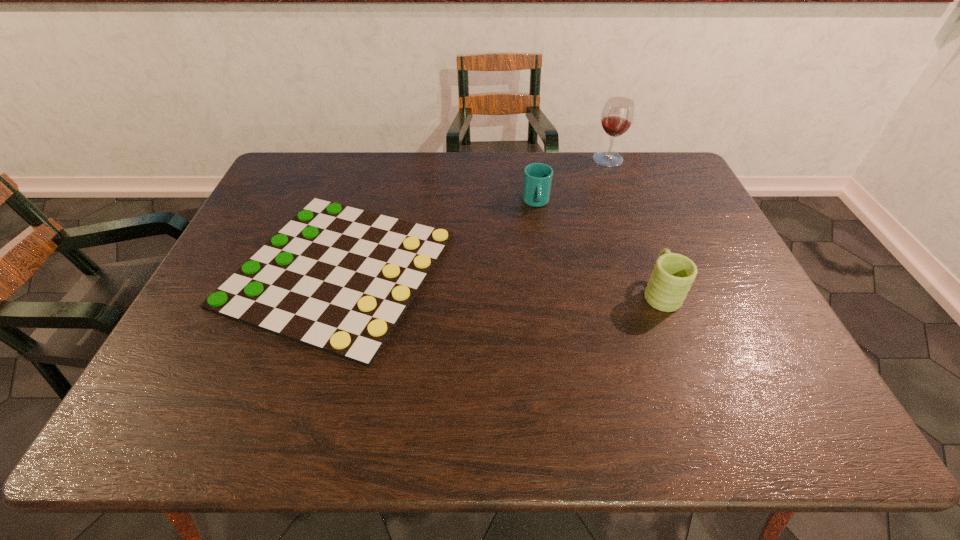
At what (x,y) coordinates should I click in order to perform the action: click on wineglass. Please return your answer as a coordinate pair (x, y). The width and height of the screenshot is (960, 540). Looking at the image, I should click on (617, 116).

You are a GUI agent. You are given a task and a screenshot of the screen. Output one action in this format:
    pyautogui.click(x=<x>, y=<y>)
    Task: Click on the farthest object
    The image size is (960, 540).
    Given the screenshot: What is the action you would take?
    [x=617, y=116]

This screenshot has width=960, height=540. What are the coordinates of `mug` in the screenshot? It's located at (671, 279).

Locate an element on the screen. This screenshot has height=540, width=960. the third object from right to left is located at coordinates (537, 182).

The width and height of the screenshot is (960, 540). In order to click on the shortest object in this screenshot , I will do `click(338, 279)`.

This screenshot has height=540, width=960. I want to click on checkerboard, so click(x=338, y=279).

Where is `free space located on the front of the farthest object`? Image resolution: width=960 pixels, height=540 pixels. free space located on the front of the farthest object is located at coordinates (614, 176).

Where is `vacant space situated 0.320m on the side of the mug with the handle`? vacant space situated 0.320m on the side of the mug with the handle is located at coordinates (625, 200).

Image resolution: width=960 pixels, height=540 pixels. What are the coordinates of `free spot located 0.340m on the side of the mug with the handle` in the screenshot? It's located at (624, 196).

Where is `free location located on the side of the mug with the handle`? The width and height of the screenshot is (960, 540). free location located on the side of the mug with the handle is located at coordinates (645, 252).